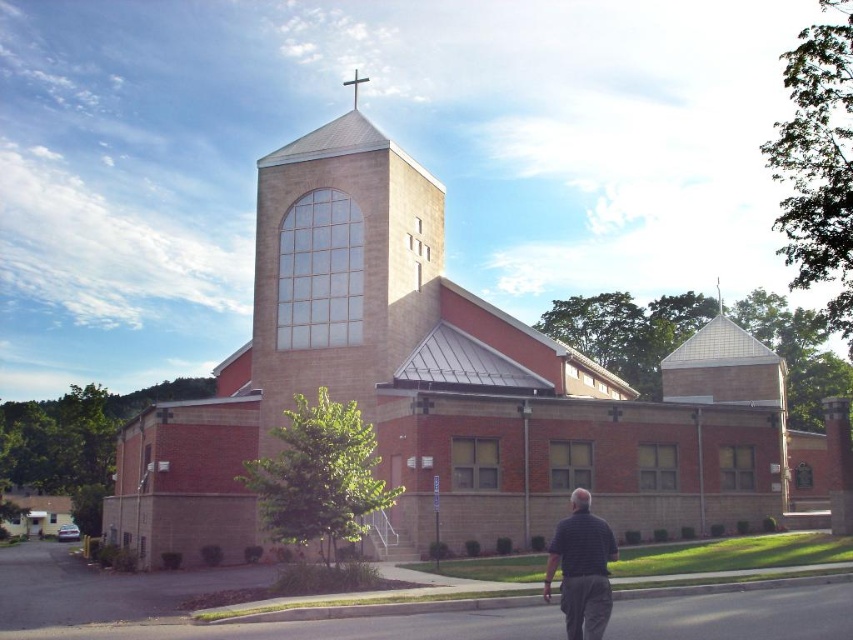
Between brick church at center and striped shirt at lower right, which one is positioned higher?

brick church at center is above.

Based on the photo, which is below, brick church at center or striped shirt at lower right?

striped shirt at lower right is below.

Does point (370, 356) come closer to viewer compared to point (563, 520)?

No, it is not.

Image resolution: width=853 pixels, height=640 pixels. What are the coordinates of `brick church at center` in the screenshot? It's located at (444, 388).